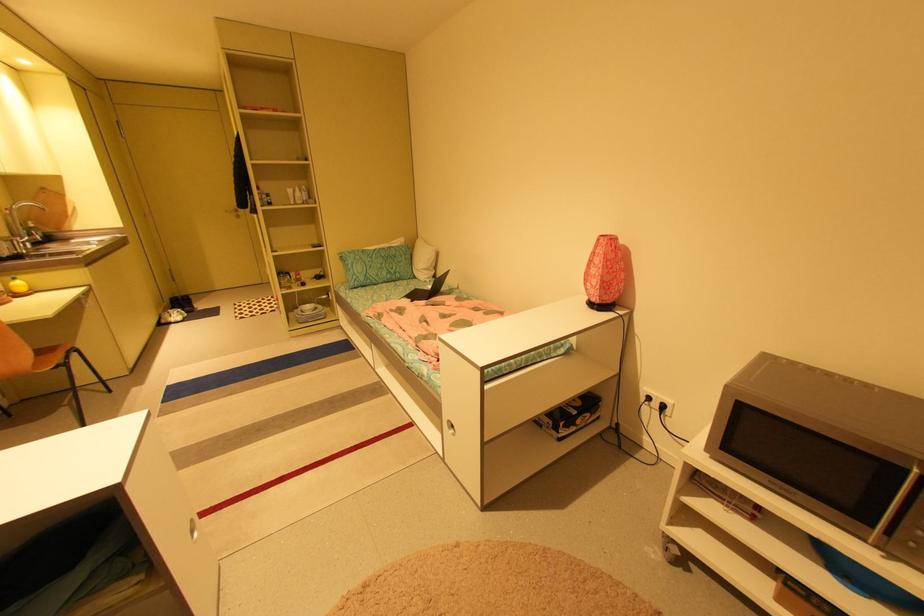
This screenshot has height=616, width=924. I want to click on red patterned lamp, so click(x=603, y=274).